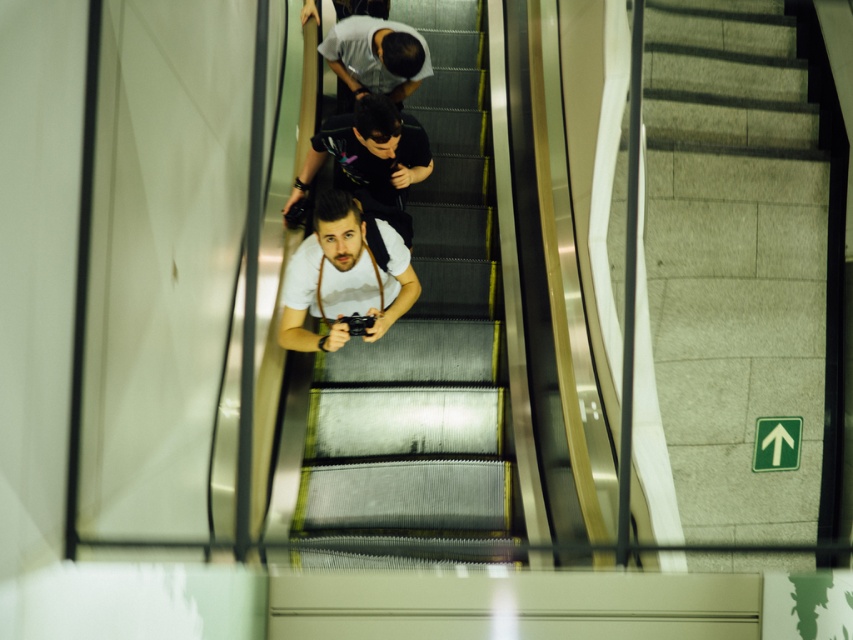
You are standing at the bottom of the metallic escalator steps at center and want to reach the person wearing the white matte shirt at center. Which direction should you move to get closer to them?

The metallic escalator steps at center is below the white matte shirt at center, so you should move upward on the metallic escalator steps at center to get closer to the white matte shirt at center.

You are standing at the base of the escalator in the subway station. You notice two points marked on the escalator steps. The first point is at coordinates point [451,476] and the second is at point [410,80]. Which point is closer to you as you face the escalator?

Point [451,476] is closer to the viewer than point [410,80].

You are standing on the escalator and see the white matte shirt at center and the matte black shirt at upper center. Which person is closer to you?

The white matte shirt at center is closer to you because it is in front of the matte black shirt at upper center.